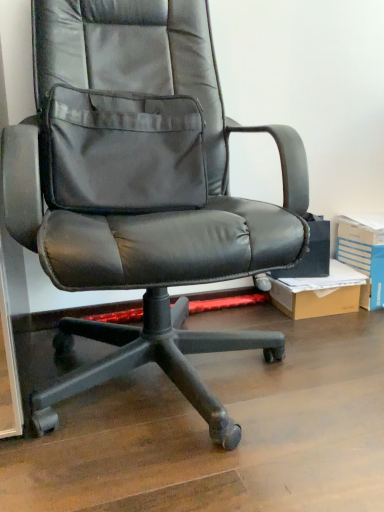
Question: From a real-world perspective, does blue cardboard box at right stand above brown cardboard box at lower right?

Choices:
 (A) no
 (B) yes

Answer: (B)

Question: From a real-world perspective, is blue cardboard box at right beneath brown cardboard box at lower right?

Choices:
 (A) yes
 (B) no

Answer: (B)

Question: Considering the relative positions of blue cardboard box at right and brown cardboard box at lower right in the image provided, is blue cardboard box at right to the right of brown cardboard box at lower right from the viewer's perspective?

Choices:
 (A) no
 (B) yes

Answer: (B)

Question: Is blue cardboard box at right positioned far away from brown cardboard box at lower right?

Choices:
 (A) no
 (B) yes

Answer: (A)

Question: From the image's perspective, is blue cardboard box at right above brown cardboard box at lower right?

Choices:
 (A) yes
 (B) no

Answer: (A)

Question: Would you say blue cardboard box at right contains brown cardboard box at lower right?

Choices:
 (A) no
 (B) yes

Answer: (A)

Question: From a real-world perspective, is brown cardboard box at lower right on black leather office chair at center?

Choices:
 (A) no
 (B) yes

Answer: (A)

Question: Does brown cardboard box at lower right turn towards black leather office chair at center?

Choices:
 (A) yes
 (B) no

Answer: (B)

Question: Does brown cardboard box at lower right have a greater width compared to black leather office chair at center?

Choices:
 (A) no
 (B) yes

Answer: (A)

Question: Does brown cardboard box at lower right have a greater height compared to black leather office chair at center?

Choices:
 (A) yes
 (B) no

Answer: (B)

Question: Is brown cardboard box at lower right at the left side of black leather office chair at center?

Choices:
 (A) no
 (B) yes

Answer: (A)

Question: Is brown cardboard box at lower right thinner than black leather office chair at center?

Choices:
 (A) yes
 (B) no

Answer: (A)

Question: Is blue cardboard box at right inside black leather office chair at center?

Choices:
 (A) yes
 (B) no

Answer: (B)